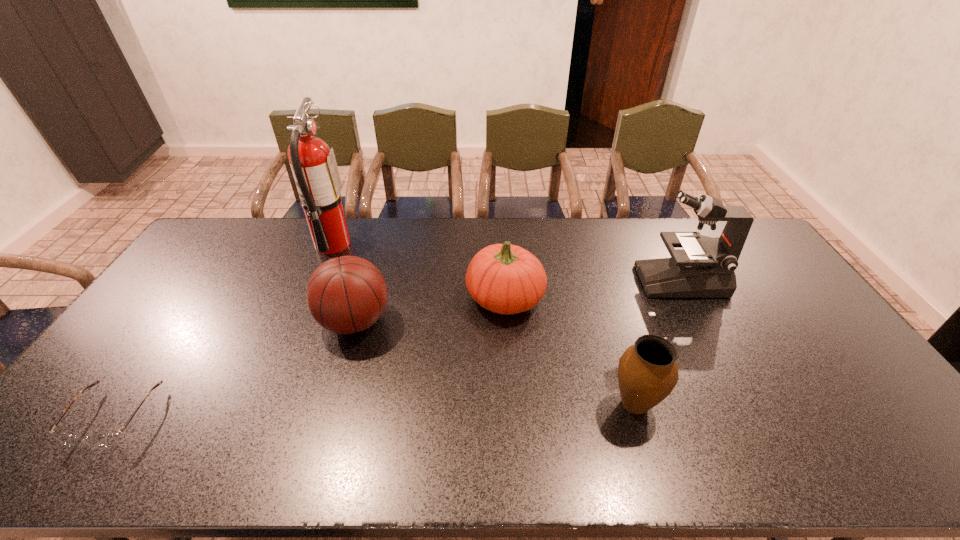
Locate an element on the screen. free spot that satisfies the following two spatial constraints: 1. through the eyepieces of the fifth shortest object; 2. on the front-facing side of the spectacles is located at coordinates (751, 416).